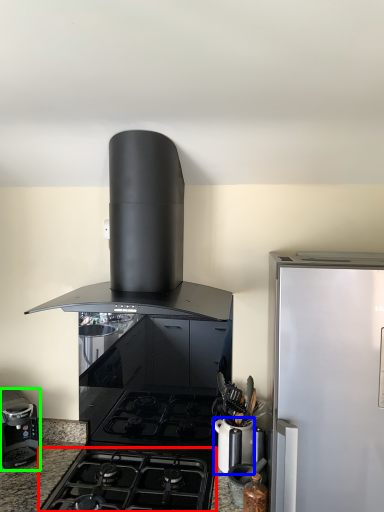
Question: Based on their relative distances, which object is nearer to gas stove (highlighted by a red box)? Choose from kitchen appliance (highlighted by a blue box) and kitchen appliance (highlighted by a green box).

Choices:
 (A) kitchen appliance
 (B) kitchen appliance

Answer: (A)